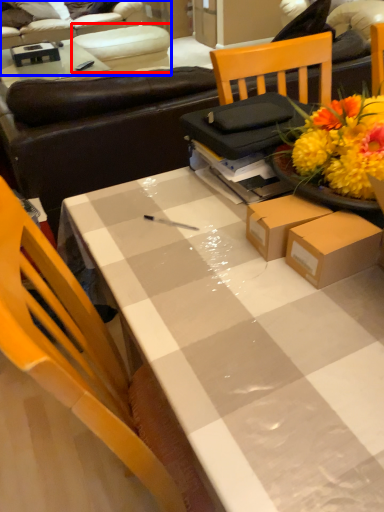
Question: Among these objects, which one is farthest to the camera, armchair (highlighted by a red box) or studio couch (highlighted by a blue box)?

Choices:
 (A) armchair
 (B) studio couch

Answer: (B)